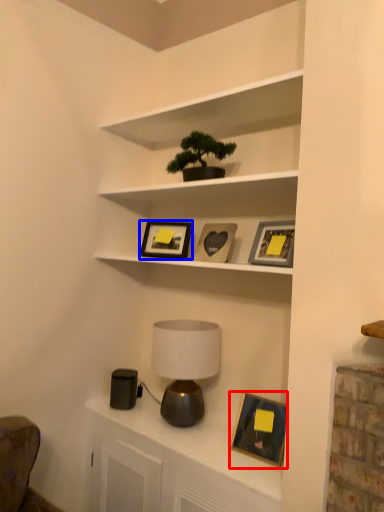
Question: Which point is further to the camera, picture frame (highlighted by a red box) or picture frame (highlighted by a blue box)?

Choices:
 (A) picture frame
 (B) picture frame

Answer: (B)